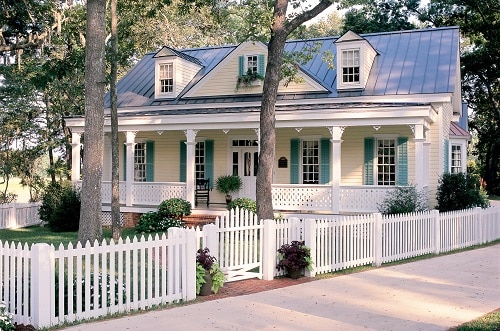
Identify the location of windows. The height and width of the screenshot is (331, 500). (457, 160), (386, 160), (312, 152), (166, 72), (138, 157), (199, 157), (242, 140), (235, 156), (246, 157), (255, 158).